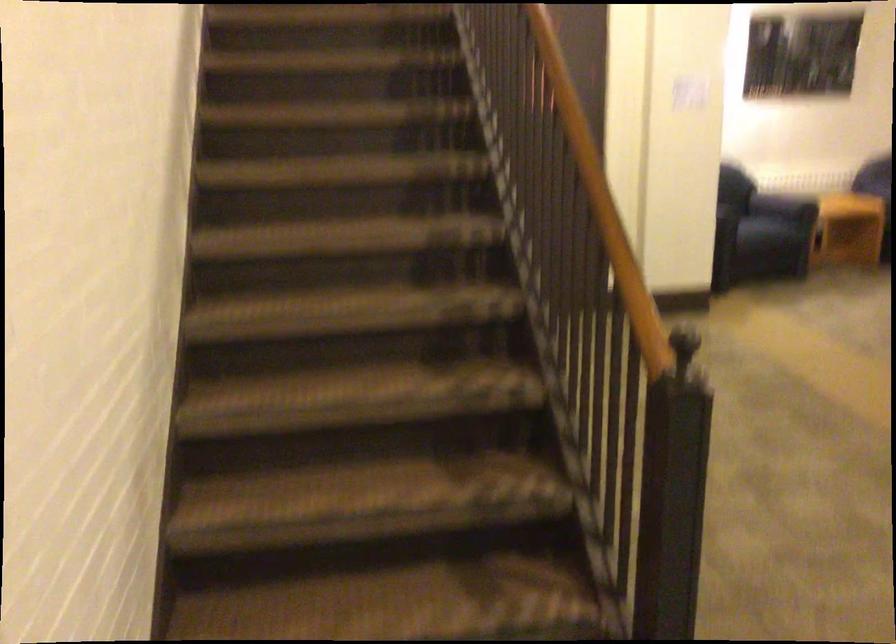
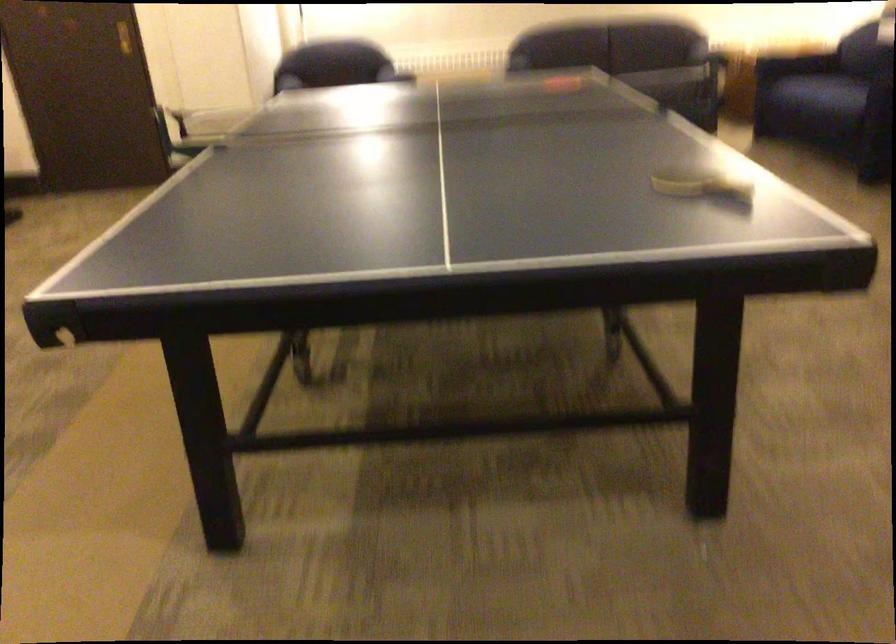
Question: Which direction would the cameraman need to move to produce the second image? Reply with the corresponding letter.

Choices:
 (A) Left
 (B) Right
 (C) Forward
 (D) Backward

Answer: (B)